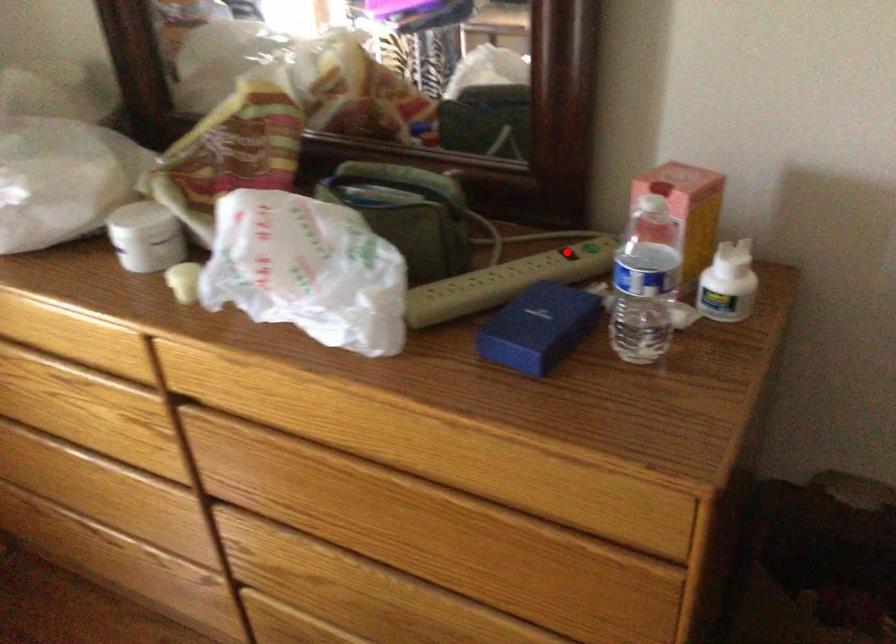
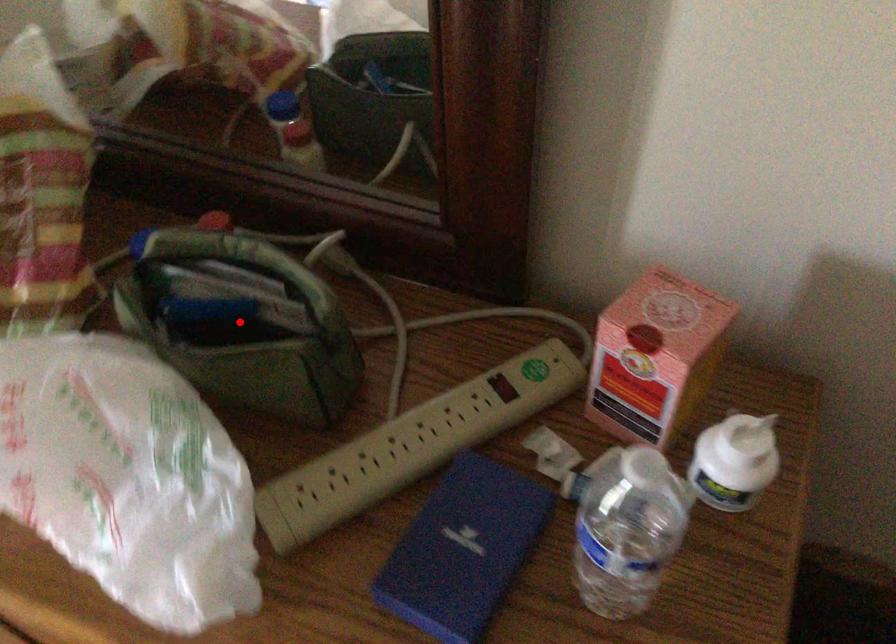
I am providing you with two images of the same scene from different viewpoints. A red point is marked on the first image and another point is marked on the second image. Do the highlighted points in image1 and image2 indicate the same real-world spot?

No